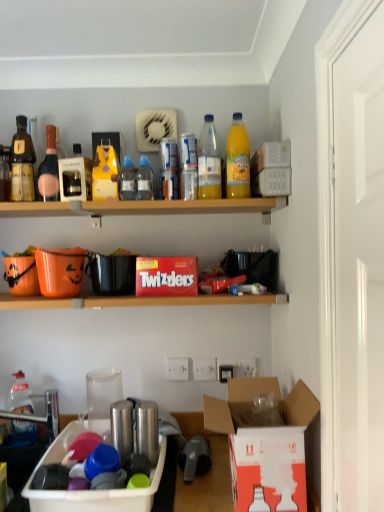
What do you see at coordinates (166, 276) in the screenshot? I see `red cardboard twizzlers at center, which ranks as the 2th box in right-to-left order` at bounding box center [166, 276].

Based on the photo, how much space does red matte twizzlers box at center, which is the first shelf in bottom-to-top order, occupy horizontally?

red matte twizzlers box at center, which is the first shelf in bottom-to-top order, is 11.14 inches wide.

The image size is (384, 512). What do you see at coordinates (355, 271) in the screenshot?
I see `white glossy door at upper right` at bounding box center [355, 271].

You are a GUI agent. You are given a task and a screenshot of the screen. Output one action in this format:
    pyautogui.click(x=<x>, y=<y>)
    Task: Click on the red cardboard twizzlers at center, the 1th box from the top
    
    Given the screenshot: What is the action you would take?
    [166, 276]

From the image's perspective, which one is positioned higher, translucent plastic bottle at lower left, acting as the first bottle starting from the left, or white plastic container at lower center, the 1th box from the bottom?

translucent plastic bottle at lower left, acting as the first bottle starting from the left.

Does translucent plastic bottle at lower left, arranged as the 1th bottle when ordered from the bottom, appear on the left side of white plastic container at lower center, placed as the third box when sorted from top to bottom?

Correct, you'll find translucent plastic bottle at lower left, arranged as the 1th bottle when ordered from the bottom, to the left of white plastic container at lower center, placed as the third box when sorted from top to bottom.

Considering the positions of point (29, 433) and point (53, 502), is point (29, 433) closer or farther from the camera than point (53, 502)?

Point (29, 433) is positioned farther from the camera compared to point (53, 502).

From a real-world perspective, is white glossy door at upper right located beneath transparent plastic bottle at center, the fifth bottle in the bottom-to-top sequence?

Correct, in the physical world, white glossy door at upper right is lower than transparent plastic bottle at center, the fifth bottle in the bottom-to-top sequence.

Consider the image. Is white glossy door at upper right thinner than transparent plastic bottle at center, which is the first bottle in right-to-left order?

In fact, white glossy door at upper right might be wider than transparent plastic bottle at center, which is the first bottle in right-to-left order.

Does point (357, 289) come in front of point (211, 170)?

Yes, it is.

From a real-world perspective, is matte glass bottle at upper left, which ranks as the 3th bottle in left-to-right order, below translucent plastic bottle at lower left, marked as the 6th bottle in a top-to-bottom arrangement?

No.

Does point (42, 186) come closer to viewer compared to point (20, 420)?

Yes.

Who is bigger, matte glass bottle at upper left, which ranks as the fourth bottle in bottom-to-top order, or translucent plastic bottle at lower left, the sixth bottle viewed from the right?

Bigger between the two is translucent plastic bottle at lower left, the sixth bottle viewed from the right.

Is point (263, 467) closer to viewer compared to point (114, 510)?

Yes.

How much distance is there between white cardboard box at lower right, which is counted as the 2th box, starting from the bottom, and white plastic container at lower center, placed as the first box when sorted from left to right?

white cardboard box at lower right, which is counted as the 2th box, starting from the bottom, and white plastic container at lower center, placed as the first box when sorted from left to right, are 36.81 centimeters apart.

Is white cardboard box at lower right, which is counted as the 2th box, starting from the bottom, inside or outside of white plastic container at lower center, placed as the third box when sorted from top to bottom?

white cardboard box at lower right, which is counted as the 2th box, starting from the bottom, is not inside white plastic container at lower center, placed as the third box when sorted from top to bottom, it's outside.

Would you say white cardboard box at lower right, marked as the 2th box in a top-to-bottom arrangement, is to the left or to the right of white plastic container at lower center, the 1th box from the bottom, in the picture?

→ In the image, white cardboard box at lower right, marked as the 2th box in a top-to-bottom arrangement, appears on the right side of white plastic container at lower center, the 1th box from the bottom.

Would you say translucent plastic cup at lower center, the 1th coffee cup from the bottom, contains white plastic container at lower left?

No, white plastic container at lower left is located outside of translucent plastic cup at lower center, the 1th coffee cup from the bottom.

I want to click on the 1st coffee cup above the white plastic container at lower left (from the image's perspective), so click(102, 398).

From the image's perspective, which one is positioned higher, translucent plastic cup at lower center, the 1th coffee cup from the bottom, or white plastic container at lower left?

translucent plastic cup at lower center, the 1th coffee cup from the bottom, appears higher in the image.

Visually, is translucent plastic cup at lower center, the 1th coffee cup from the bottom, positioned to the left or to the right of white plastic container at lower left?

Based on their positions, translucent plastic cup at lower center, the 1th coffee cup from the bottom, is located to the left of white plastic container at lower left.

How far apart are white plastic container at lower center, placed as the third box when sorted from top to bottom, and transparent plastic straw at upper center?

They are 38.26 inches apart.

Which point is more distant from viewer, (155, 479) or (232, 137)?

The point (232, 137) is behind.

Can you confirm if white plastic container at lower center, placed as the first box when sorted from left to right, is shorter than transparent plastic straw at upper center?

Yes.

Consider the image. How much distance is there between translucent plastic bottle at lower left, arranged as the 1th bottle when ordered from the bottom, and translucent plastic cup at lower center, the 2th coffee cup from the top?

translucent plastic bottle at lower left, arranged as the 1th bottle when ordered from the bottom, and translucent plastic cup at lower center, the 2th coffee cup from the top, are 10.18 inches apart.

Considering the positions of objects translucent plastic bottle at lower left, the sixth bottle viewed from the right, and translucent plastic cup at lower center, the 2th coffee cup from the top, in the image provided, who is more to the left, translucent plastic bottle at lower left, the sixth bottle viewed from the right, or translucent plastic cup at lower center, the 2th coffee cup from the top,?

From the viewer's perspective, translucent plastic bottle at lower left, the sixth bottle viewed from the right, appears more on the left side.

From a real-world perspective, which is physically above, translucent plastic bottle at lower left, arranged as the 1th bottle when ordered from the bottom, or translucent plastic cup at lower center, the 1th coffee cup from the bottom?

translucent plastic cup at lower center, the 1th coffee cup from the bottom.

Based on the photo, is translucent plastic bottle at lower left, marked as the 6th bottle in a top-to-bottom arrangement, beside translucent plastic cup at lower center, the 2th coffee cup from the top?

No, translucent plastic bottle at lower left, marked as the 6th bottle in a top-to-bottom arrangement, is not making contact with translucent plastic cup at lower center, the 2th coffee cup from the top.

I want to click on box that is below the translucent plastic bottle at lower left, acting as the first bottle starting from the left (from the image's perspective), so click(x=91, y=490).

Identify the location of door in front of the transparent plastic bottle at center, which appears as the 6th bottle when viewed from the left. (355, 271).

From the image, which object appears to be farther from black matte coffee cup at center, which is the second coffee cup in bottom-to-top order, orange matte plastic bucket at left or red cardboard twizzlers at center, acting as the 3th box starting from the bottom?

The object further to black matte coffee cup at center, which is the second coffee cup in bottom-to-top order, is red cardboard twizzlers at center, acting as the 3th box starting from the bottom.

Considering their positions, is matte glass bottle at upper left, the third bottle from the top, positioned closer to white cardboard box at lower right, which is counted as the first box, starting from the right, than transparent plastic bottle at upper center, which ranks as the fifth bottle in top-to-bottom order?

transparent plastic bottle at upper center, which ranks as the fifth bottle in top-to-bottom order, lies closer to white cardboard box at lower right, which is counted as the first box, starting from the right, than the other object.

Which object lies nearer to the anchor point white cardboard box at lower right, marked as the 2th box in a top-to-bottom arrangement, red cardboard twizzlers at center, acting as the 3th box starting from the bottom, or transparent plastic bottle at center, the fifth bottle in the bottom-to-top sequence?

Based on the image, red cardboard twizzlers at center, acting as the 3th box starting from the bottom, appears to be nearer to white cardboard box at lower right, marked as the 2th box in a top-to-bottom arrangement.

Which object lies nearer to the anchor point translucent plastic bottle at upper center, the 4th bottle positioned from the top, white plastic container at lower left or red cardboard twizzlers at center, which is counted as the 2th box, starting from the left?

red cardboard twizzlers at center, which is counted as the 2th box, starting from the left, is positioned closer to the anchor translucent plastic bottle at upper center, the 4th bottle positioned from the top.

Estimate the real-world distances between objects in this image. Which object is further from black matte coffee cup at center, placed as the first coffee cup when sorted from top to bottom, white glossy door at upper right or white cardboard box at lower right, which is counted as the 2th box, starting from the bottom?

Among the two, white glossy door at upper right is located further to black matte coffee cup at center, placed as the first coffee cup when sorted from top to bottom.

From the image, which object appears to be farther from translucent plastic bottle at upper center, marked as the third bottle in a right-to-left arrangement, transparent plastic bottle at upper center, which is counted as the 2th bottle, starting from the bottom, or white cardboard box at lower right, which appears as the 3th box when viewed from the left?

white cardboard box at lower right, which appears as the 3th box when viewed from the left, is further to translucent plastic bottle at upper center, marked as the third bottle in a right-to-left arrangement.

From the picture: Estimate the real-world distances between objects in this image. Which object is closer to white glossy door at upper right, transparent plastic bottle at upper center, arranged as the second bottle when viewed from the right, or translucent plastic bottle at upper center, the 4th bottle positioned from the top?

Based on the image, transparent plastic bottle at upper center, arranged as the second bottle when viewed from the right, appears to be nearer to white glossy door at upper right.

Estimate the real-world distances between objects in this image. Which object is closer to orange matte plastic bucket at left, red matte twizzlers box at center, the second shelf when ordered from top to bottom, or matte glass bottle at upper left, the third bottle from the top?

Based on the image, red matte twizzlers box at center, the second shelf when ordered from top to bottom, appears to be nearer to orange matte plastic bucket at left.

Image resolution: width=384 pixels, height=512 pixels. I want to click on bucket between transparent plastic bottle at upper center, which is counted as the 2th bottle, starting from the bottom, and white plastic container at lower left in the up-down direction, so click(60, 271).

In order to click on shelf between black matte coffee cup at center, placed as the first coffee cup when sorted from top to bottom, and translucent plastic bottle at lower left, marked as the 6th bottle in a top-to-bottom arrangement, in the vertical direction in this screenshot , I will do `click(136, 301)`.

Identify the location of shelf between transparent plastic bottle at upper center, arranged as the 5th bottle when viewed from the left, and red matte twizzlers box at center, which is the first shelf in bottom-to-top order, vertically. (143, 207).

In order to click on shelf between transparent plastic straw at upper center and red cardboard twizzlers at center, which ranks as the 2th box in right-to-left order, in the up-down direction in this screenshot , I will do point(143,207).